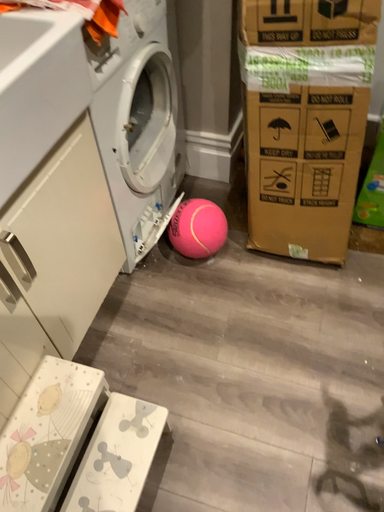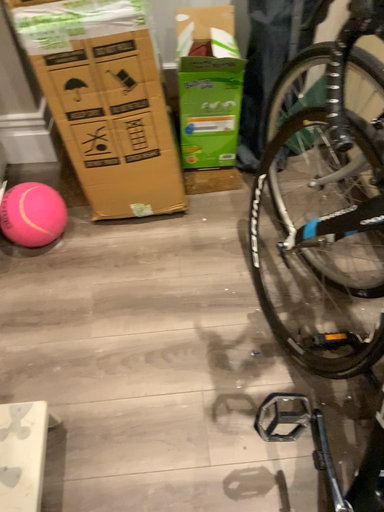
Question: How did the camera likely rotate when shooting the video?

Choices:
 (A) rotated right
 (B) rotated left

Answer: (A)